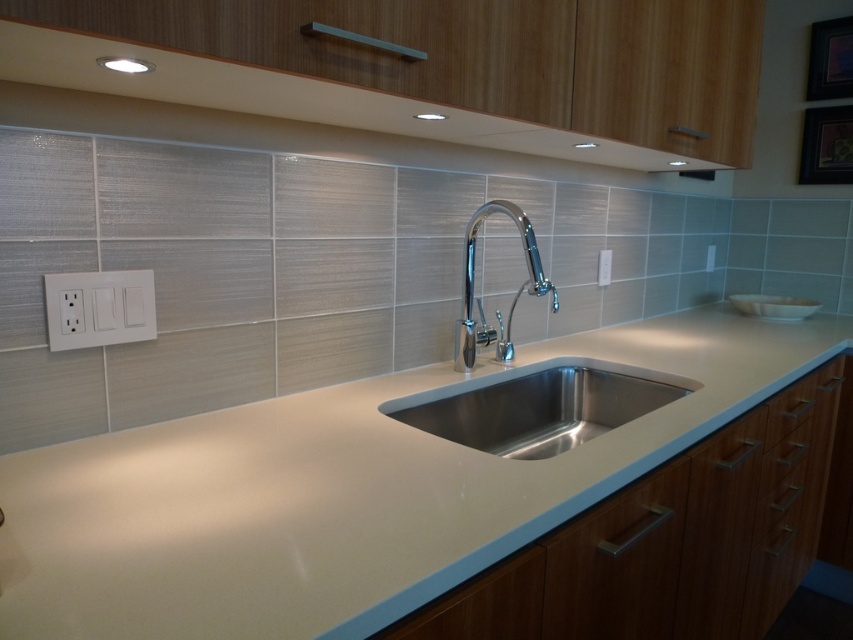
You are a drone operator trying to position your drone between two points marked on the kitchen countertop. The first point is at point (x=108, y=481) and the second point is at point (x=793, y=385). Since you need to ensure the drone stays at the same height as the countertop, which point should you set as the reference for the drone to maintain its altitude?

You should set point (x=108, y=481) as the reference because it is closer to the camera, meaning it is at a lower altitude compared to point (x=793, y=385). By using this point, the drone can maintain the correct height relative to the countertop.